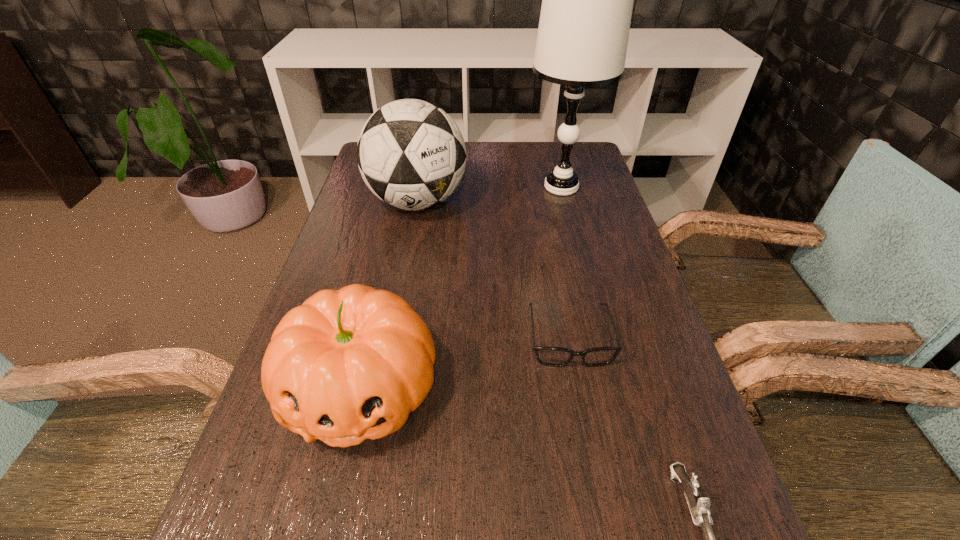
Find the location of a particular element. Image resolution: width=960 pixels, height=540 pixels. the tallest object is located at coordinates (587, 0).

At what (x,y) coordinates should I click in order to perform the action: click on soccer ball. Please return your answer as a coordinate pair (x, y). Looking at the image, I should click on (411, 154).

The image size is (960, 540). I want to click on the third shortest object, so (x=347, y=365).

Where is `the shortest object`? the shortest object is located at coordinates (550, 356).

Where is `free spot located 0.370m on the front of the tallest object`? The width and height of the screenshot is (960, 540). free spot located 0.370m on the front of the tallest object is located at coordinates (590, 301).

At what (x,y) coordinates should I click in order to perform the action: click on free space located 0.350m on the surface of the fourth shortest object where the brand logo is visible. Please return your answer as a coordinate pair (x, y). This screenshot has width=960, height=540. Looking at the image, I should click on (394, 333).

Where is `vacant area located 0.060m on the carved face of the third tallest object`? This screenshot has width=960, height=540. vacant area located 0.060m on the carved face of the third tallest object is located at coordinates (334, 503).

The image size is (960, 540). Find the location of `vacant space located on the front-facing side of the spectacles`. vacant space located on the front-facing side of the spectacles is located at coordinates (592, 460).

This screenshot has width=960, height=540. I want to click on table lamp that is at the far edge, so click(587, 0).

The height and width of the screenshot is (540, 960). Find the location of `soccer ball that is at the far edge`. soccer ball that is at the far edge is located at coordinates (411, 154).